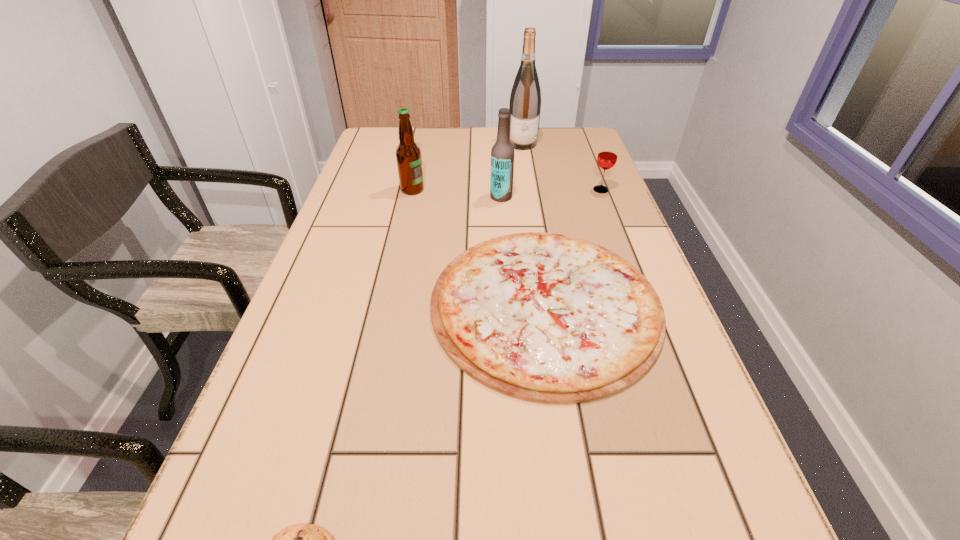
Locate an element on the screen. the tallest object is located at coordinates (525, 101).

This screenshot has height=540, width=960. Find the location of `wine bottle`. wine bottle is located at coordinates (525, 101).

Image resolution: width=960 pixels, height=540 pixels. Identify the location of the right beer bottle. (502, 153).

This screenshot has height=540, width=960. What are the coordinates of `the left beer bottle` in the screenshot? It's located at (408, 154).

Identify the location of the fourth tallest object. (607, 156).

At what (x,y) coordinates should I click in order to perform the action: click on pizza. Please return your answer as a coordinate pair (x, y). Looking at the image, I should click on (544, 317).

Find the location of a particular element. the fifth tallest object is located at coordinates (544, 317).

Find the location of a particular element. Image resolution: width=960 pixels, height=540 pixels. vacant region located 0.400m on the label of the wine bottle is located at coordinates (535, 221).

Where is `free space located on the label of the right beer bottle`? This screenshot has width=960, height=540. free space located on the label of the right beer bottle is located at coordinates (353, 197).

Identify the location of vacant space located 0.240m on the label of the right beer bottle. The height and width of the screenshot is (540, 960). (404, 197).